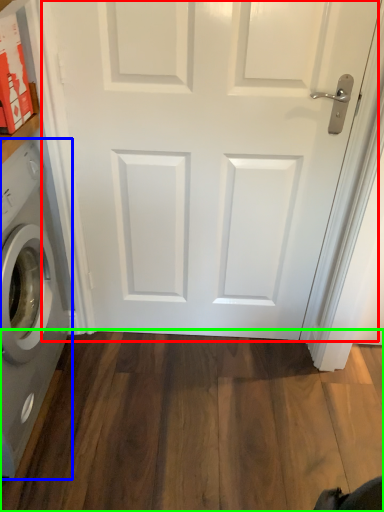
Question: Considering the real-world distances, which object is closest to door (highlighted by a red box)? washing machine (highlighted by a blue box) or hardwood (highlighted by a green box).

Choices:
 (A) washing machine
 (B) hardwood

Answer: (A)